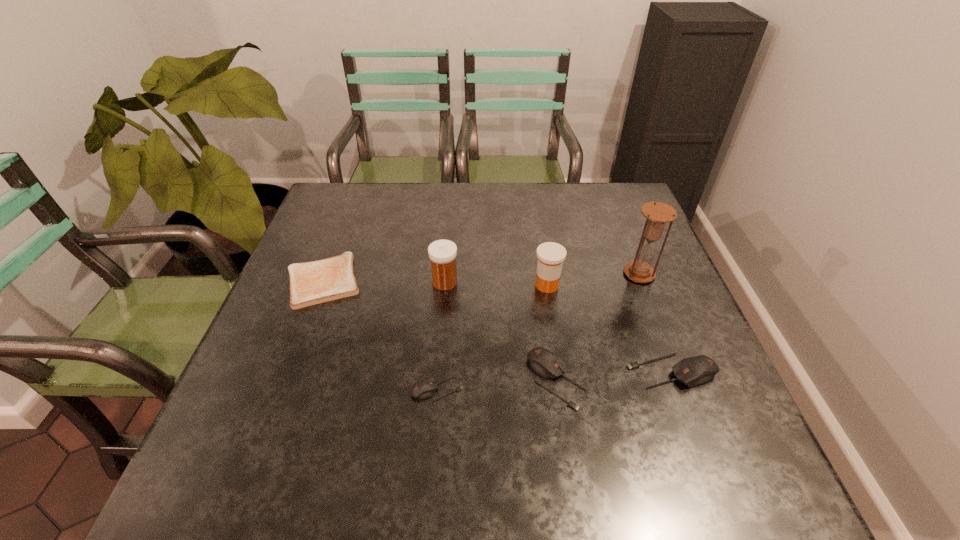
At what (x,y) coordinates should I click in order to perform the action: click on vacant space that satisfies the following two spatial constraints: 1. on the back side of the hourglass; 2. on the left side of the shortest mouse. Please return your answer as a coordinate pair (x, y). The image size is (960, 540). Looking at the image, I should click on (446, 274).